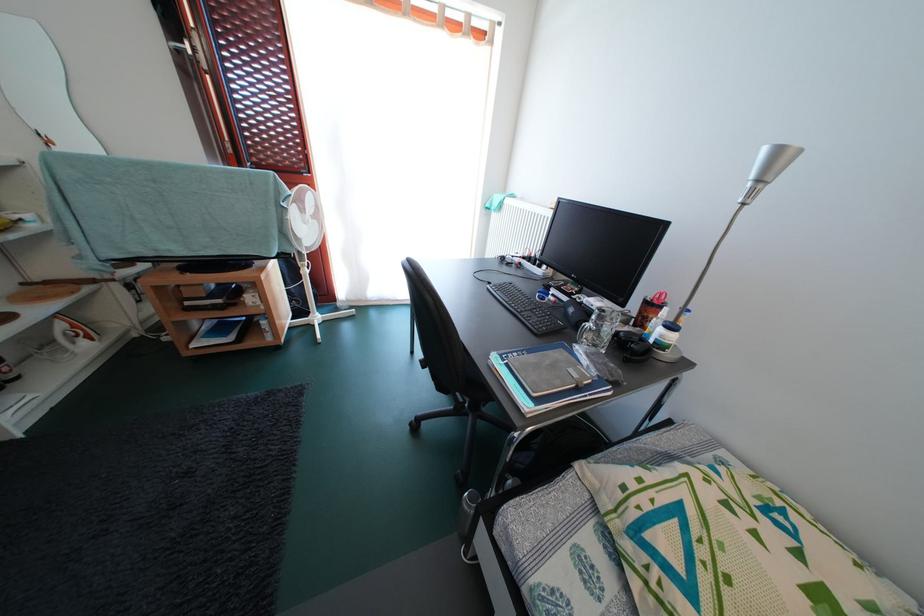
The height and width of the screenshot is (616, 924). What are the coordinates of `chair sitting surface` in the screenshot? It's located at (468, 455).